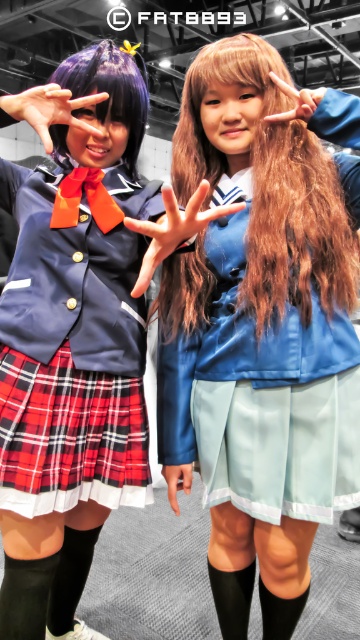
Does matte blue uniform at center have a lesser height compared to shiny brown hair at center?

In fact, matte blue uniform at center may be taller than shiny brown hair at center.

You are a GUI agent. You are given a task and a screenshot of the screen. Output one action in this format:
    pyautogui.click(x=<x>, y=<y>)
    Task: Click on the matte blue uniform at center
    This screenshot has height=640, width=360.
    Given the screenshot: What is the action you would take?
    pyautogui.click(x=72, y=333)

Identify the location of satin blue dress at center. The width and height of the screenshot is (360, 640). (262, 397).

Identify the location of satin blue dress at center. This screenshot has width=360, height=640. (262, 397).

Identify the location of satin blue dress at center. (262, 397).

Does matte blue uniform at center appear on the right side of purple silky hair at upper left?

In fact, matte blue uniform at center is to the left of purple silky hair at upper left.

Between matte blue uniform at center and purple silky hair at upper left, which one has more height?

matte blue uniform at center is taller.

This screenshot has width=360, height=640. What do you see at coordinates (72, 333) in the screenshot?
I see `matte blue uniform at center` at bounding box center [72, 333].

Locate an element on the screen. This screenshot has height=640, width=360. matte blue uniform at center is located at coordinates (72, 333).